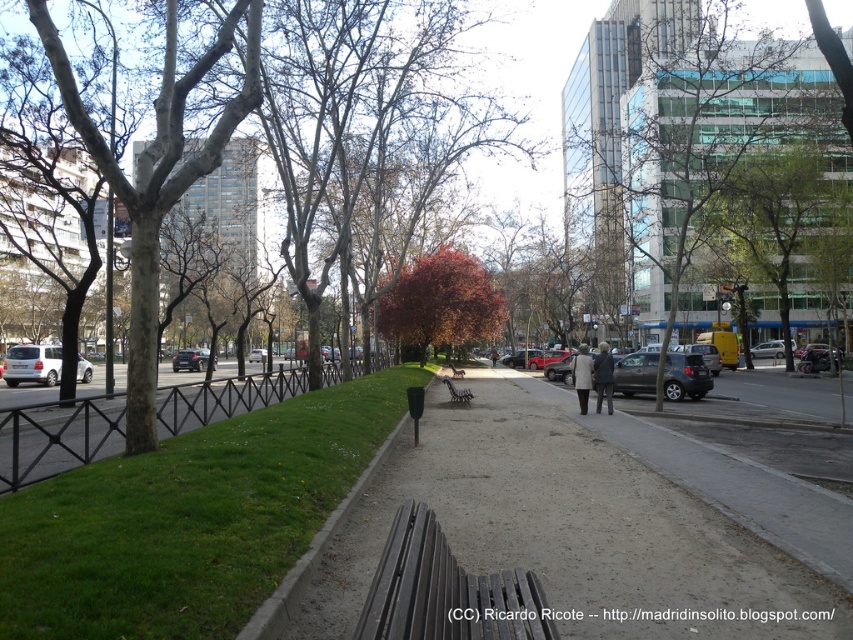
Question: Considering the real-world distances, which object is farthest from the green leafy tree at upper right?

Choices:
 (A) autumnal leaves tree at center
 (B) matte silver car at center-left
 (C) brown dirt path at center

Answer: (B)

Question: Does matte silver van at left have a smaller size compared to silver metallic car at center-right?

Choices:
 (A) yes
 (B) no

Answer: (A)

Question: Is brown gravel path at center thinner than silver metallic car at center-right?

Choices:
 (A) yes
 (B) no

Answer: (A)

Question: Which point is closer to the camera?

Choices:
 (A) (492, 356)
 (B) (515, 593)
 (C) (259, 630)

Answer: (B)

Question: Does smooth bark tree at left appear over autumnal leaves tree at center?

Choices:
 (A) no
 (B) yes

Answer: (B)

Question: Among these points, which one is farthest from the camera?

Choices:
 (A) (579, 388)
 (B) (492, 353)

Answer: (B)